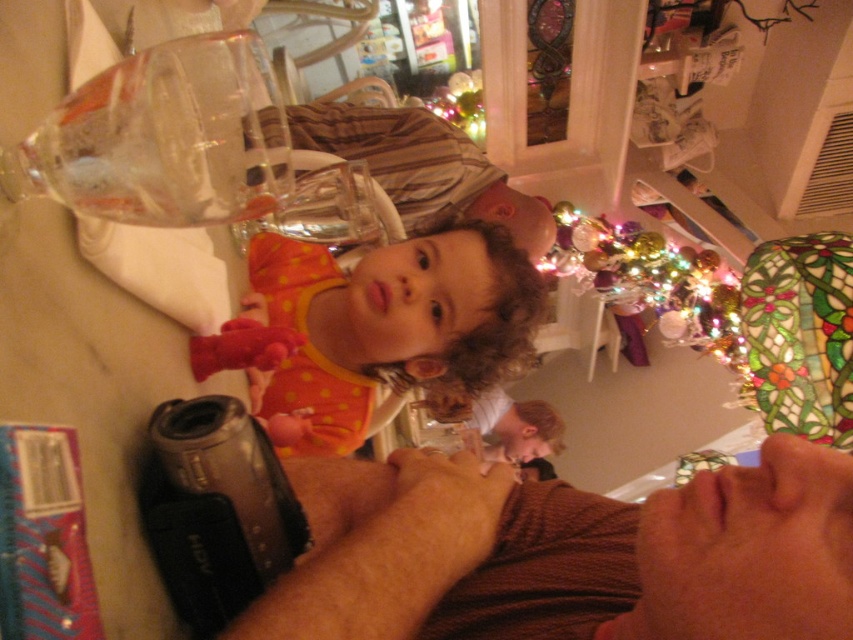
You are a photographer at the festive gathering. You want to capture a photo of the child wearing the orange polka dot dress at center and the adult wearing the striped cotton shirt at upper center. Based on their positions, which clothing item is positioned to the left of the other?

The orange polka dot dress at center is to the left of the striped cotton shirt at upper center.